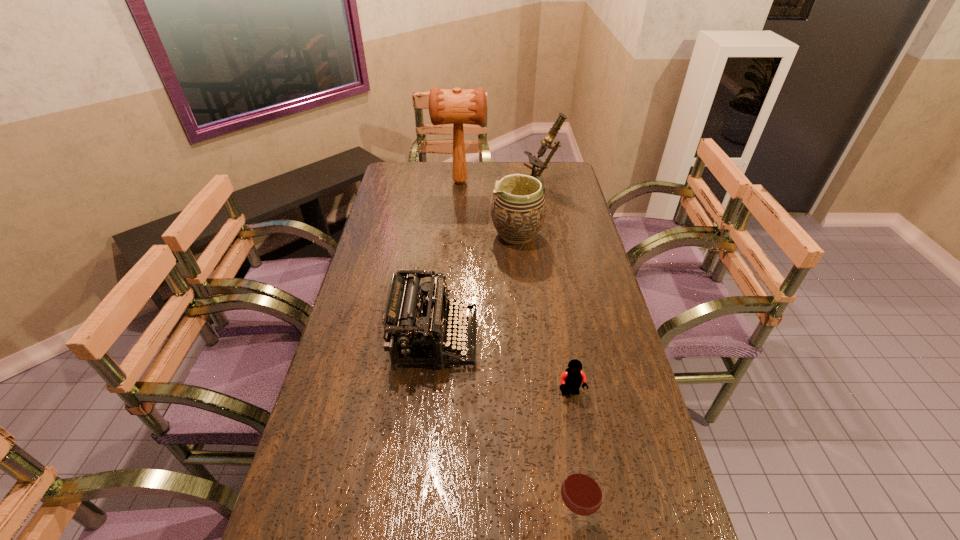
Where is `the tallest object`? This screenshot has width=960, height=540. the tallest object is located at coordinates (469, 106).

Where is `microscope`? This screenshot has width=960, height=540. microscope is located at coordinates point(536,163).

Find the location of a particular element. The height and width of the screenshot is (540, 960). the third farthest object is located at coordinates (518, 210).

Where is `pottery`? pottery is located at coordinates (518, 210).

At what (x,y) coordinates should I click in order to perform the action: click on the fourth tallest object. Please return your answer as a coordinate pair (x, y). This screenshot has height=540, width=960. Looking at the image, I should click on (414, 326).

Where is `the third nearest object`? the third nearest object is located at coordinates (414, 326).

Where is `the nearest object`? the nearest object is located at coordinates (582, 491).

Where is `the second shortest object`? The image size is (960, 540). the second shortest object is located at coordinates (582, 491).

The height and width of the screenshot is (540, 960). I want to click on the second nearest object, so click(x=571, y=380).

Where is `Lego`? This screenshot has height=540, width=960. Lego is located at coordinates (571, 380).